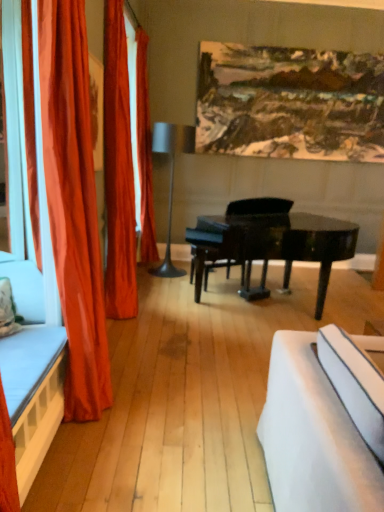
Question: Is wooden bed frame at left facing away from metallic gray floor lamp at center?

Choices:
 (A) yes
 (B) no

Answer: (B)

Question: From a real-world perspective, is wooden bed frame at left located higher than metallic gray floor lamp at center?

Choices:
 (A) yes
 (B) no

Answer: (B)

Question: Is wooden bed frame at left beside metallic gray floor lamp at center?

Choices:
 (A) yes
 (B) no

Answer: (B)

Question: Is wooden bed frame at left facing towards metallic gray floor lamp at center?

Choices:
 (A) yes
 (B) no

Answer: (B)

Question: Can you confirm if wooden bed frame at left is smaller than metallic gray floor lamp at center?

Choices:
 (A) yes
 (B) no

Answer: (A)

Question: Can you confirm if wooden bed frame at left is taller than metallic gray floor lamp at center?

Choices:
 (A) no
 (B) yes

Answer: (A)

Question: Considering the relative sizes of black glossy piano at center and velvet orange curtain at left, which appears as the 2th curtain when viewed from the back, in the image provided, is black glossy piano at center thinner than velvet orange curtain at left, which appears as the 2th curtain when viewed from the back,?

Choices:
 (A) no
 (B) yes

Answer: (A)

Question: From a real-world perspective, is black glossy piano at center on top of velvet orange curtain at left, which appears as the 2th curtain when viewed from the back?

Choices:
 (A) yes
 (B) no

Answer: (B)

Question: Does black glossy piano at center have a smaller size compared to velvet orange curtain at left, which appears as the 2th curtain when viewed from the back?

Choices:
 (A) yes
 (B) no

Answer: (B)

Question: Is black glossy piano at center facing away from velvet orange curtain at left, which ranks as the second curtain in front-to-back order?

Choices:
 (A) no
 (B) yes

Answer: (A)

Question: Does black glossy piano at center have a larger size compared to velvet orange curtain at left, which appears as the 2th curtain when viewed from the back?

Choices:
 (A) no
 (B) yes

Answer: (B)

Question: From a real-world perspective, is black glossy piano at center located beneath velvet orange curtain at left, which appears as the 2th curtain when viewed from the back?

Choices:
 (A) yes
 (B) no

Answer: (A)

Question: Is metallic gray floor lamp at center touching velvet orange curtain at left, which appears as the 2th curtain when viewed from the back?

Choices:
 (A) no
 (B) yes

Answer: (A)